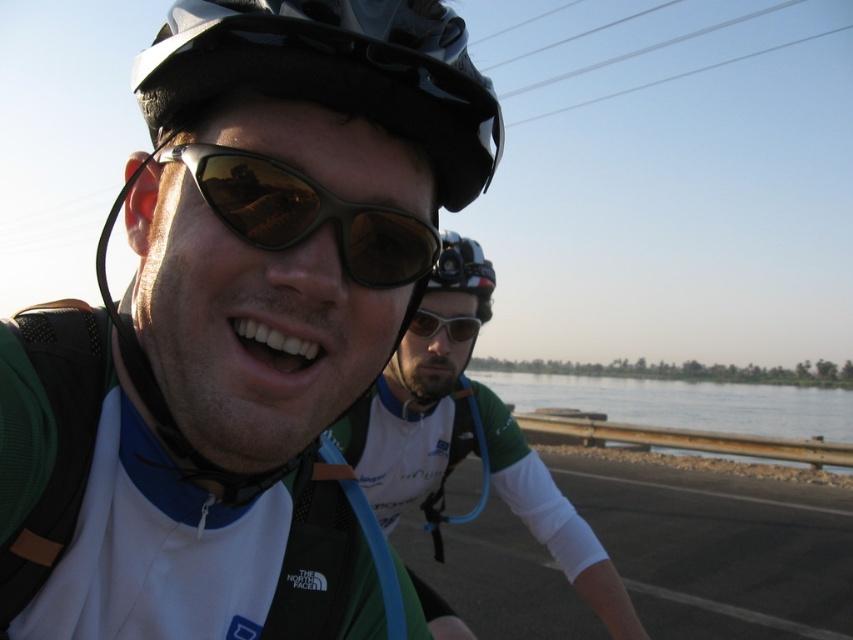
Does matte black helmet at upper center have a lesser height compared to clear water at river right?

Yes.

This screenshot has width=853, height=640. Find the location of `matte black helmet at upper center`. matte black helmet at upper center is located at coordinates (334, 72).

What do you see at coordinates (236, 324) in the screenshot? I see `matte black helmet at center` at bounding box center [236, 324].

In the scene shown: Who is higher up, matte black helmet at center or matte black helmet at upper center?

Positioned higher is matte black helmet at upper center.

The width and height of the screenshot is (853, 640). What do you see at coordinates (236, 324) in the screenshot? I see `matte black helmet at center` at bounding box center [236, 324].

The height and width of the screenshot is (640, 853). I want to click on matte black helmet at center, so click(x=236, y=324).

Who is more forward, (158,68) or (473,252)?

Positioned in front is point (158,68).

Does matte black helmet at upper center have a smaller size compared to black matte helmet at center?

Yes.

Identify the location of matte black helmet at upper center. (334, 72).

Find the location of a particular element. The height and width of the screenshot is (640, 853). matte black helmet at upper center is located at coordinates 334,72.